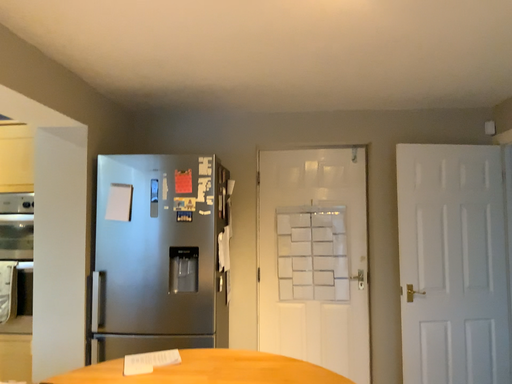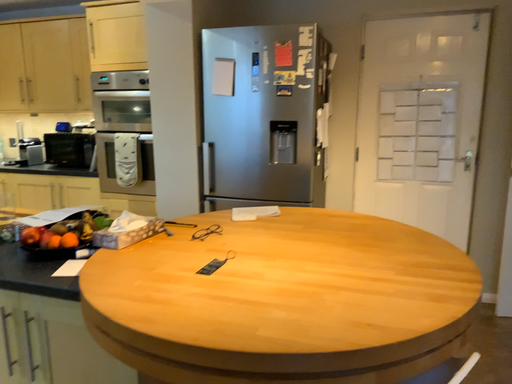
Question: Which way did the camera rotate in the video?

Choices:
 (A) rotated left
 (B) rotated right

Answer: (A)